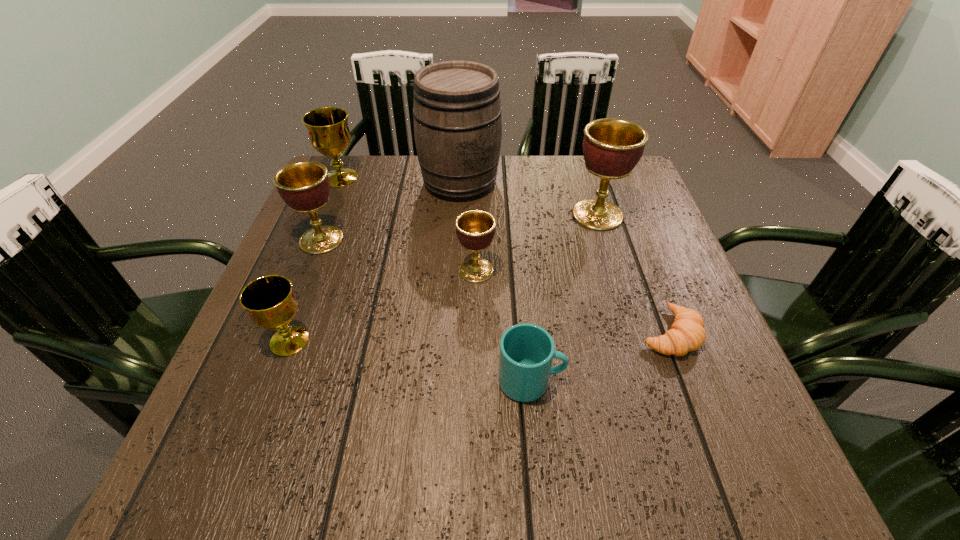
Select which object appears as the second closest to the crescent roll. Please provide its 2D coordinates. Your answer should be formatted as a tuple, i.e. [(x, y)], where the tuple contains the x and y coordinates of a point satisfying the conditions above.

[(612, 147)]

Locate which object ranks fifth in proximity to the second golden chalice from left to right. Please provide its 2D coordinates. Your answer should be formatted as a tuple, i.e. [(x, y)], where the tuple contains the x and y coordinates of a point satisfying the conditions above.

[(687, 333)]

Identify which chalice is the closest to the leftmost golden chalice. Please provide its 2D coordinates. Your answer should be formatted as a tuple, i.e. [(x, y)], where the tuple contains the x and y coordinates of a point satisfying the conditions above.

[(329, 134)]

The width and height of the screenshot is (960, 540). I want to click on the closest chalice to the nearest golden chalice, so click(x=612, y=147).

Locate an element on the screen. golden chalice that is the third closest to the bigger gold chalice is located at coordinates (612, 147).

Locate which golden chalice ranks third in proximity to the smaller gold chalice. Please provide its 2D coordinates. Your answer should be formatted as a tuple, i.e. [(x, y)], where the tuple contains the x and y coordinates of a point satisfying the conditions above.

[(612, 147)]

This screenshot has height=540, width=960. In order to click on free location that satisfies the following two spatial constraints: 1. on the front side of the shortest object; 2. on the right side of the farther gold chalice in this screenshot , I will do `click(277, 333)`.

You are a GUI agent. You are given a task and a screenshot of the screen. Output one action in this format:
    pyautogui.click(x=<x>, y=<y>)
    Task: Click on the free location that satisfies the following two spatial constraints: 1. on the front side of the crescent roll; 2. on the right side of the fourth chalice from left to right
    This screenshot has height=540, width=960.
    Given the screenshot: What is the action you would take?
    pyautogui.click(x=475, y=333)

Locate an element on the screen. The height and width of the screenshot is (540, 960). free space that satisfies the following two spatial constraints: 1. on the front side of the wine bucket; 2. on the right side of the nearest golden chalice is located at coordinates (455, 271).

Where is `free space in the image that satisfies the following two spatial constraints: 1. on the back side of the nearer gold chalice; 2. on the right side of the tallest object`? This screenshot has height=540, width=960. free space in the image that satisfies the following two spatial constraints: 1. on the back side of the nearer gold chalice; 2. on the right side of the tallest object is located at coordinates (349, 182).